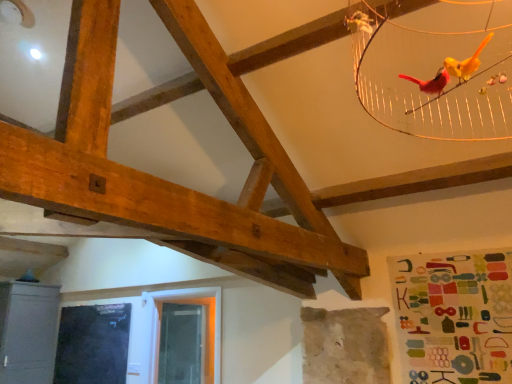
Question: Considering the relative sizes of black glass window screen at lower left, which is counted as the first window screen, starting from the left, and transparent plastic window screen at lower center, the 1th window screen positioned from the right, in the image provided, is black glass window screen at lower left, which is counted as the first window screen, starting from the left, wider than transparent plastic window screen at lower center, the 1th window screen positioned from the right,?

Choices:
 (A) no
 (B) yes

Answer: (A)

Question: Considering the relative sizes of black glass window screen at lower left, placed as the 2th window screen when sorted from right to left, and transparent plastic window screen at lower center, the 1th window screen positioned from the right, in the image provided, is black glass window screen at lower left, placed as the 2th window screen when sorted from right to left, smaller than transparent plastic window screen at lower center, the 1th window screen positioned from the right,?

Choices:
 (A) yes
 (B) no

Answer: (A)

Question: Are black glass window screen at lower left, which is counted as the first window screen, starting from the left, and transparent plastic window screen at lower center, the 1th window screen positioned from the right, located far from each other?

Choices:
 (A) no
 (B) yes

Answer: (A)

Question: Is transparent plastic window screen at lower center, which is the second window screen in left-to-right order, completely or partially inside black glass window screen at lower left, placed as the 2th window screen when sorted from right to left?

Choices:
 (A) yes
 (B) no

Answer: (B)

Question: Can you confirm if black glass window screen at lower left, placed as the 2th window screen when sorted from right to left, is taller than transparent plastic window screen at lower center, which is the second window screen in left-to-right order?

Choices:
 (A) no
 (B) yes

Answer: (A)

Question: Can we say black glass window screen at lower left, which is counted as the first window screen, starting from the left, lies outside transparent plastic window screen at lower center, which is the second window screen in left-to-right order?

Choices:
 (A) no
 (B) yes

Answer: (B)

Question: Is transparent plastic window screen at lower center, the 1th window screen positioned from the right, outside black glass window screen at lower left, placed as the 2th window screen when sorted from right to left?

Choices:
 (A) yes
 (B) no

Answer: (A)

Question: Does transparent plastic window screen at lower center, which is the second window screen in left-to-right order, have a smaller size compared to black glass window screen at lower left, which is counted as the first window screen, starting from the left?

Choices:
 (A) no
 (B) yes

Answer: (A)

Question: Could you tell me if transparent plastic window screen at lower center, which is the second window screen in left-to-right order, is turned towards black glass window screen at lower left, which is counted as the first window screen, starting from the left?

Choices:
 (A) yes
 (B) no

Answer: (B)

Question: Is transparent plastic window screen at lower center, which is the second window screen in left-to-right order, to the right of black glass window screen at lower left, placed as the 2th window screen when sorted from right to left, from the viewer's perspective?

Choices:
 (A) no
 (B) yes

Answer: (B)

Question: Does transparent plastic window screen at lower center, which is the second window screen in left-to-right order, come in front of black glass window screen at lower left, placed as the 2th window screen when sorted from right to left?

Choices:
 (A) yes
 (B) no

Answer: (B)

Question: Is transparent plastic window screen at lower center, which is the second window screen in left-to-right order, at the left side of black glass window screen at lower left, which is counted as the first window screen, starting from the left?

Choices:
 (A) no
 (B) yes

Answer: (A)

Question: Is metallic gray cabinet at lower left shorter than transparent plastic window screen at lower center, the 1th window screen positioned from the right?

Choices:
 (A) yes
 (B) no

Answer: (B)